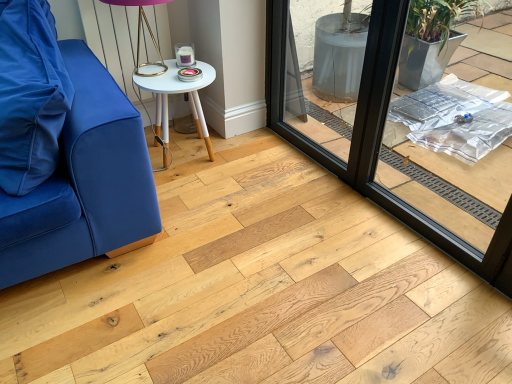
Locate an element on the screen. This screenshot has width=512, height=384. free point above white wood side table at center (from a real-world perspective) is located at coordinates (182, 72).